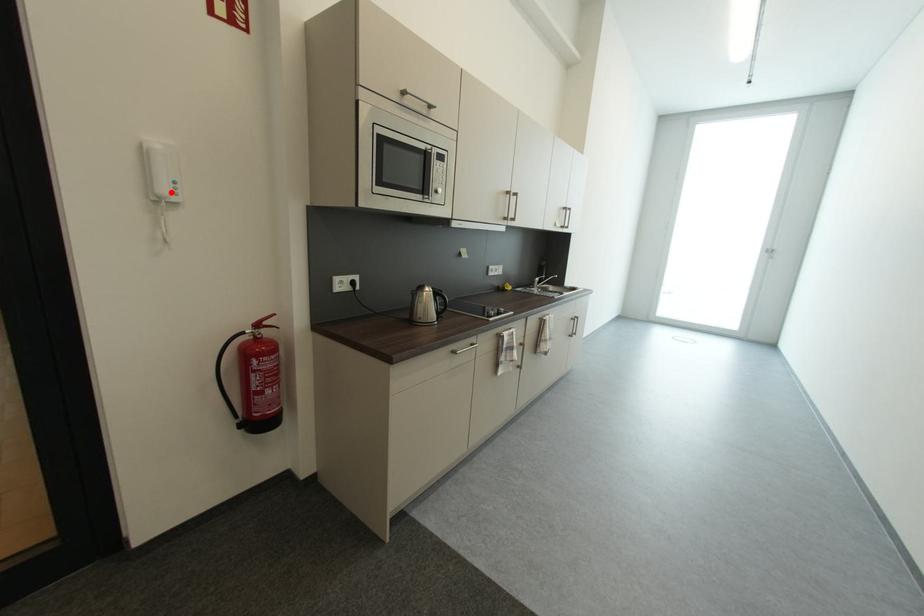
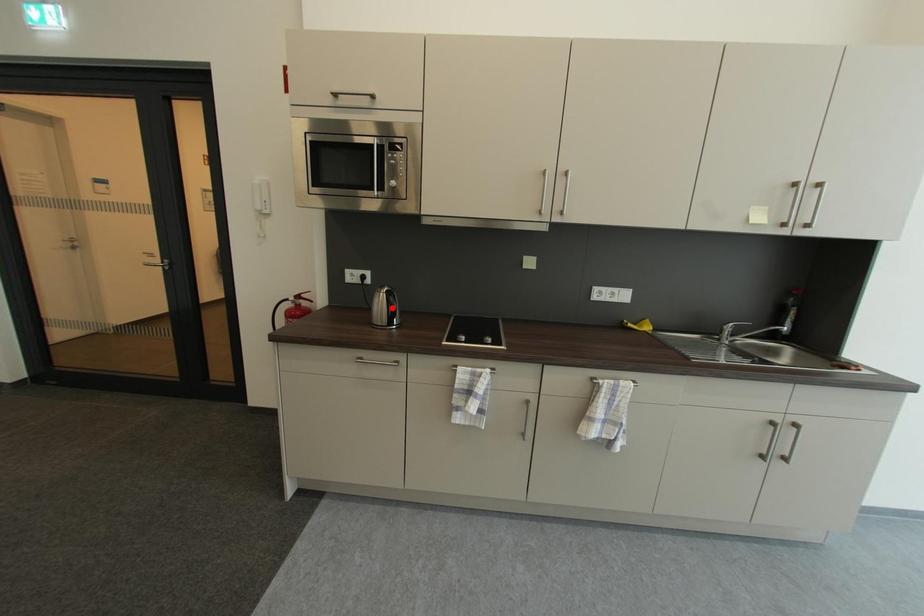
I am providing you with two images of the same scene from different viewpoints. A red point is marked on the first image and another point is marked on the second image. Is the red point in image1 aligned with the point shown in image2?

No